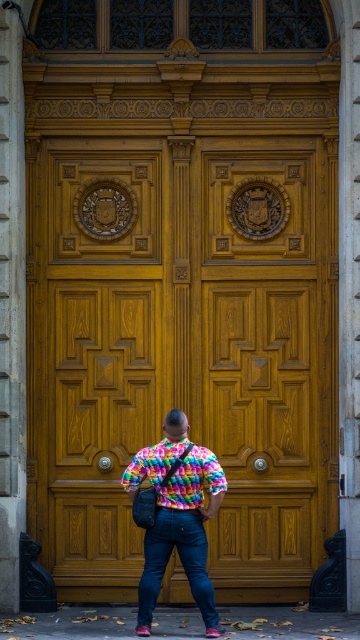
Question: Which object is farther from the camera taking this photo?

Choices:
 (A) denim at center
 (B) wooden door at center

Answer: (B)

Question: Estimate the real-world distances between objects in this image. Which object is closer to the denim at center?

Choices:
 (A) wooden door at center
 (B) rainbow tie-dye shirt at center
 (C) multicolored fabric shirt at center

Answer: (C)

Question: Which object appears farthest from the camera in this image?

Choices:
 (A) multicolored fabric shirt at center
 (B) denim at center
 (C) rainbow tie-dye shirt at center
 (D) wooden door at center

Answer: (D)

Question: Is wooden door at center closer to camera compared to multicolored fabric shirt at center?

Choices:
 (A) no
 (B) yes

Answer: (A)

Question: Is wooden door at center to the left of denim at center from the viewer's perspective?

Choices:
 (A) yes
 (B) no

Answer: (B)

Question: Is denim at center closer to the viewer compared to rainbow tie-dye shirt at center?

Choices:
 (A) no
 (B) yes

Answer: (B)